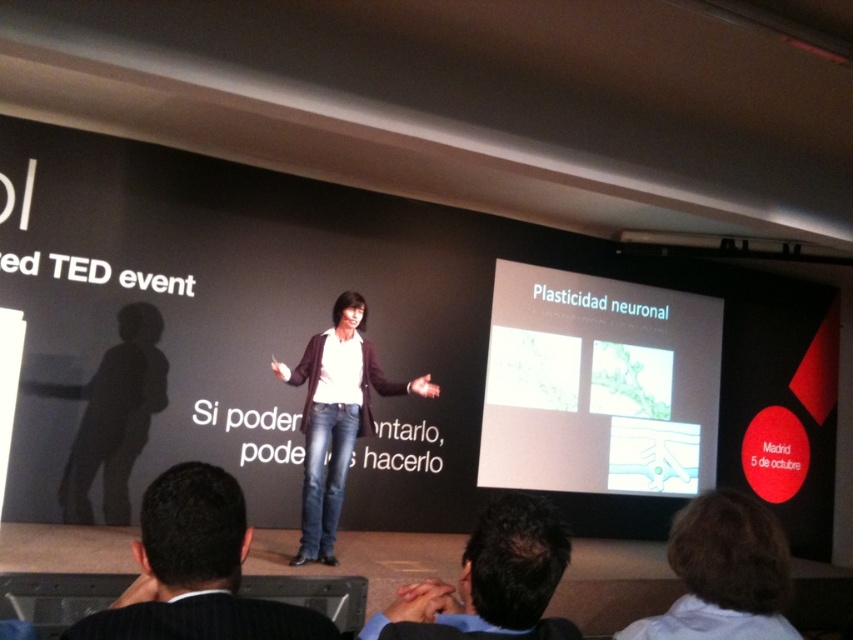
Looking at this image, does dark brown hair at upper right have a larger size compared to denim jeans at center?

Incorrect, dark brown hair at upper right is not larger than denim jeans at center.

From the picture: Is dark brown hair at upper right wider than denim jeans at center?

Incorrect, dark brown hair at upper right's width does not surpass denim jeans at center's.

Image resolution: width=853 pixels, height=640 pixels. Describe the element at coordinates (723, 573) in the screenshot. I see `dark brown hair at upper right` at that location.

Where is `dark brown hair at upper right`? dark brown hair at upper right is located at coordinates pyautogui.click(x=723, y=573).

Can you confirm if matte white slide at center is positioned to the left of dark brown hair at upper center?

Yes, matte white slide at center is to the left of dark brown hair at upper center.

Based on the photo, is matte white slide at center positioned in front of dark brown hair at upper center?

No, it is not.

In order to click on matte white slide at center in this screenshot , I will do `click(387, 349)`.

Does black suit at lower left have a lesser height compared to denim jeans at center?

Indeed, black suit at lower left has a lesser height compared to denim jeans at center.

Looking at this image, who is shorter, black suit at lower left or denim jeans at center?

With less height is black suit at lower left.

Locate an element on the screen. This screenshot has height=640, width=853. black suit at lower left is located at coordinates (195, 570).